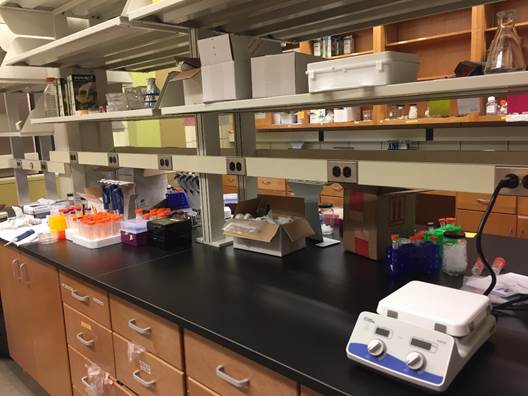
This screenshot has height=396, width=528. Identify the location of empty shelves. [x=429, y=65], [x=424, y=29].